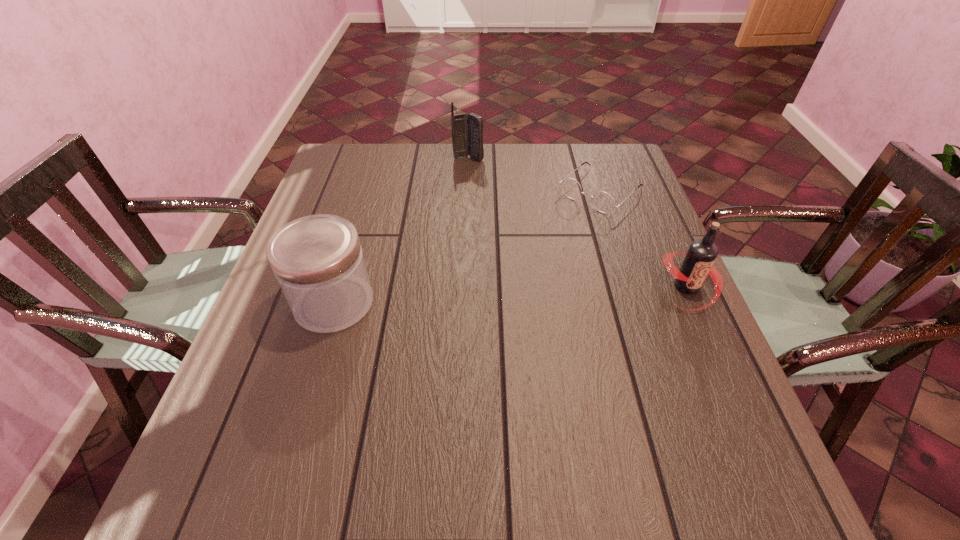
The height and width of the screenshot is (540, 960). In order to click on free location at the far edge in this screenshot , I will do `click(393, 144)`.

In the image, there is a desktop. At what (x,y) coordinates should I click in order to perform the action: click on vacant region at the left edge. Please return your answer as a coordinate pair (x, y). Image resolution: width=960 pixels, height=540 pixels. Looking at the image, I should click on coord(370,197).

The image size is (960, 540). I want to click on vacant space at the right edge, so click(678, 352).

At what (x,y) coordinates should I click in order to perform the action: click on free region at the far left corner of the desktop. Please return your answer as a coordinate pair (x, y). Image resolution: width=960 pixels, height=540 pixels. Looking at the image, I should click on (365, 183).

Where is `free space at the far right corner of the desktop`? The width and height of the screenshot is (960, 540). free space at the far right corner of the desktop is located at coordinates (588, 161).

The width and height of the screenshot is (960, 540). I want to click on vacant area between the root beer and the spectacles, so click(x=644, y=239).

The height and width of the screenshot is (540, 960). Identify the location of free space between the jar and the root beer. (511, 295).

Locate an element on the screen. Image resolution: width=960 pixels, height=540 pixels. free space between the leftmost object and the root beer is located at coordinates (511, 295).

Where is `vacant area that lies between the leftmost object and the root beer`? This screenshot has height=540, width=960. vacant area that lies between the leftmost object and the root beer is located at coordinates (511, 295).

Locate an element on the screen. This screenshot has width=960, height=540. free spot between the second farthest object and the jar is located at coordinates (468, 247).